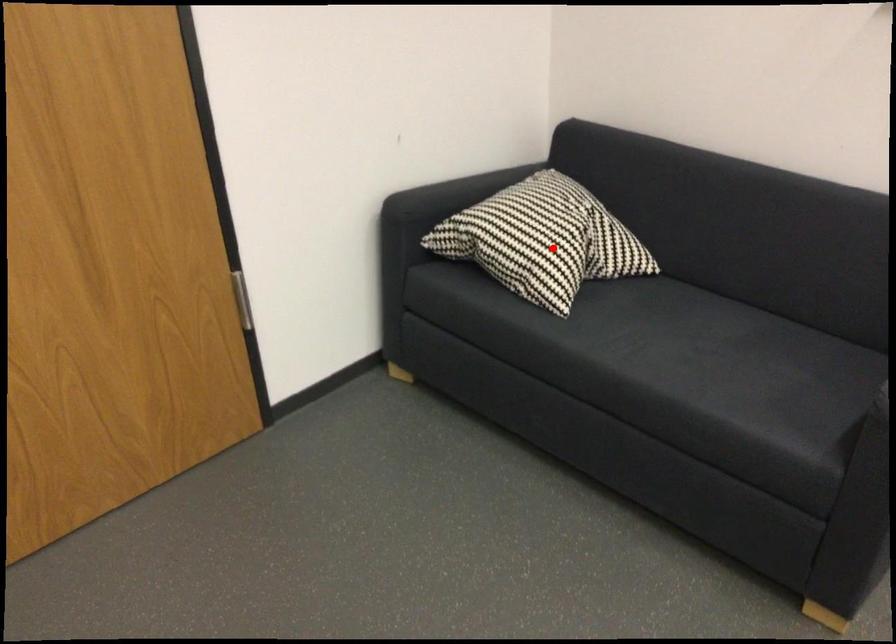
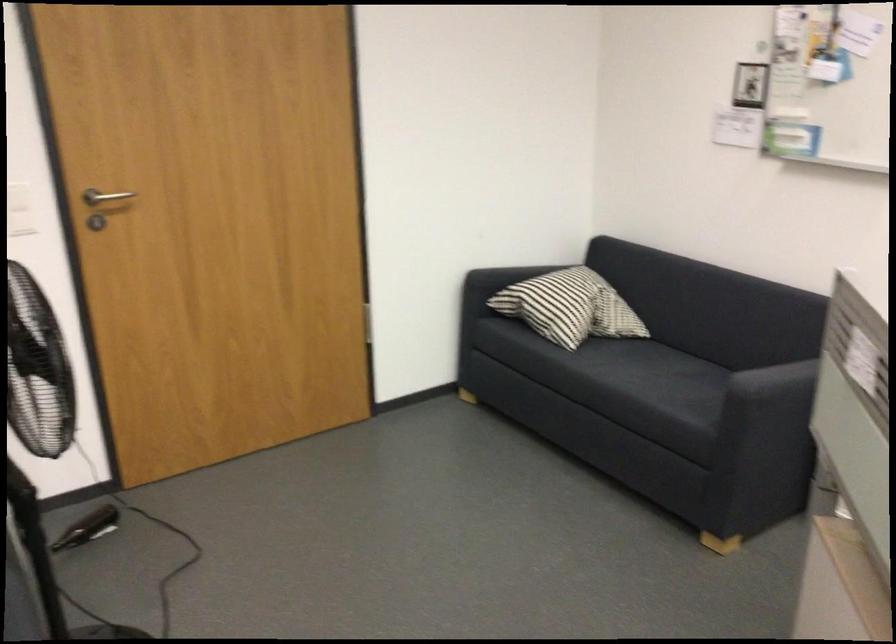
In the second image, find the point that corresponds to the highlighted location in the first image.

(570, 307)